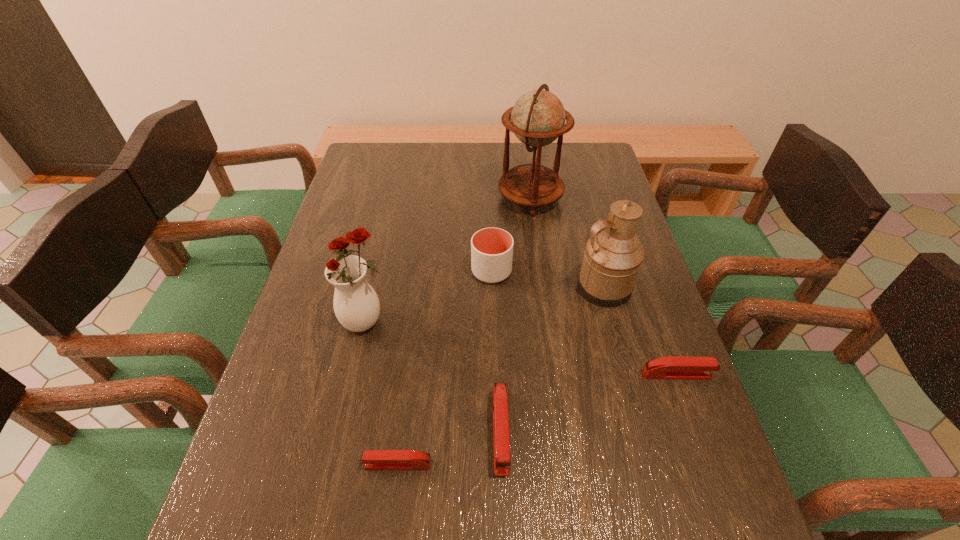
Image resolution: width=960 pixels, height=540 pixels. I want to click on the shortest object, so click(373, 459).

Where is `the shortest stapler`? This screenshot has height=540, width=960. the shortest stapler is located at coordinates (373, 459).

The width and height of the screenshot is (960, 540). What are the coordinates of `the second stapler from right to left` in the screenshot? It's located at (501, 438).

What are the coordinates of `the farthest stapler` in the screenshot? It's located at (672, 367).

Locate an element on the screen. This screenshot has height=540, width=960. the rightmost stapler is located at coordinates (672, 367).

This screenshot has height=540, width=960. What are the coordinates of `globe` in the screenshot? It's located at (538, 117).

This screenshot has width=960, height=540. Find the location of `the tallest object`. the tallest object is located at coordinates (538, 117).

Image resolution: width=960 pixels, height=540 pixels. Identify the location of vase. (356, 305).

Where is `the fourth shortest object`? Image resolution: width=960 pixels, height=540 pixels. the fourth shortest object is located at coordinates [x=491, y=248].

I want to click on pitcher, so click(613, 256).